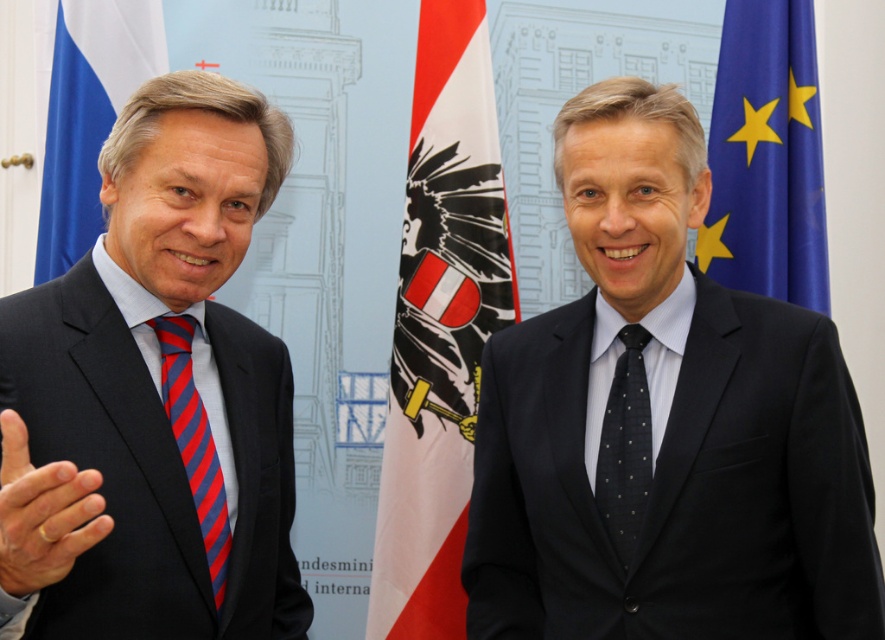
You are standing in front of the image and want to locate the matte black suit at left. According to the coordinates provided, where exactly is it positioned?

The matte black suit at left is positioned at coordinates point (154, 394).